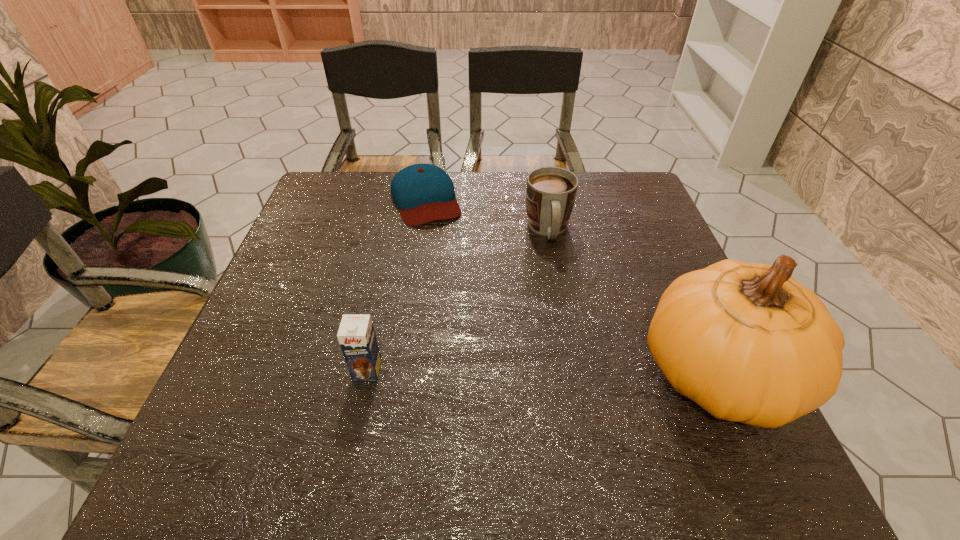
This screenshot has height=540, width=960. Identify the location of free space located 0.250m with the bill of the shortest object facing forward. (459, 291).

Find the location of a particular element. This screenshot has width=960, height=540. mug located at the far edge is located at coordinates (551, 191).

Where is `baseball cap at the far edge`? The image size is (960, 540). baseball cap at the far edge is located at coordinates pos(423,193).

The height and width of the screenshot is (540, 960). What are the coordinates of `chocolate milk situated at the near edge` in the screenshot? It's located at (356, 336).

The width and height of the screenshot is (960, 540). What are the coordinates of `pumpkin located at the near edge` in the screenshot? It's located at click(x=748, y=343).

Identify the location of object positioned at the right edge. Image resolution: width=960 pixels, height=540 pixels. (748, 343).

At what (x,y) coordinates should I click in order to perform the action: click on object at the near right corner. Please return your answer as a coordinate pair (x, y). This screenshot has height=540, width=960. Looking at the image, I should click on (748, 343).

Where is `blank space at the near edge`? blank space at the near edge is located at coordinates (333, 397).

Locate an element on the screen. Image resolution: width=960 pixels, height=540 pixels. vacant space at the left edge of the desktop is located at coordinates (334, 241).

Where is `vacant space at the right edge of the desktop`? vacant space at the right edge of the desktop is located at coordinates pos(668,270).